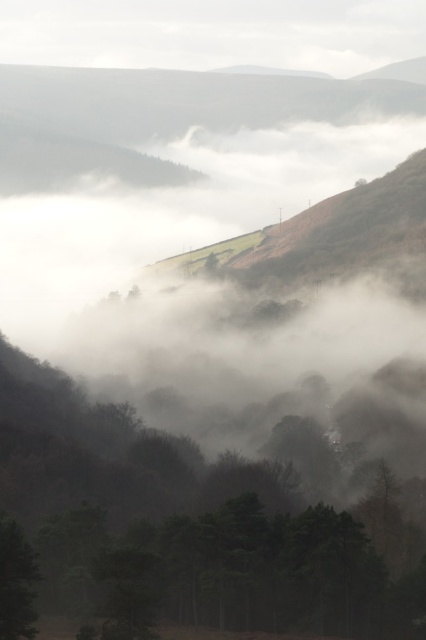
You are an observer standing in the misty landscape. You notice two green matte trees in the scene. Which one is positioned higher up in the image, the green matte tree at center or the green matte tree at lower left?

The green matte tree at lower left is positioned higher up in the image because the green matte tree at center is located below it.

Based on the photo, you are standing at the point with coordinates point (19, 605) and want to walk towards the point with coordinates point (386, 477). Given the misty landscape described, will the path between these two points be obscured by mist?

Yes, the path between point (19, 605) and point (386, 477) will be obscured by mist because the mist thickens in the mid and far distances, and point (386, 477) is behind point (19, 605), meaning it is further away where the mist is denser.